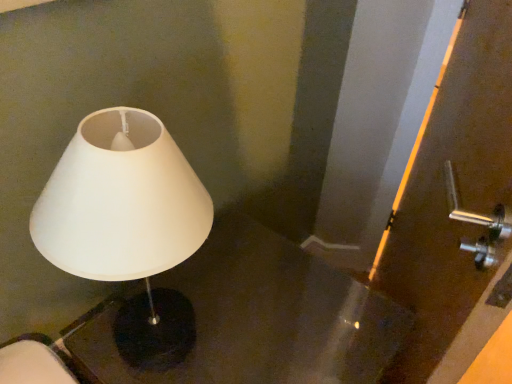
The width and height of the screenshot is (512, 384). What are the coordinates of `black glossy table at left` in the screenshot? It's located at (259, 318).

Locate an element on the screen. The height and width of the screenshot is (384, 512). white matte lampshade at left is located at coordinates [127, 226].

Locate an element on the screen. The height and width of the screenshot is (384, 512). black glossy table at left is located at coordinates (259, 318).

Is white matte lampshade at left oriented away from black glossy table at left?

Result: No, white matte lampshade at left is not facing the opposite direction of black glossy table at left.

How distant is white matte lampshade at left from black glossy table at left?

white matte lampshade at left is 13.62 inches away from black glossy table at left.

Can you confirm if white matte lampshade at left is thinner than black glossy table at left?

Yes.

Does white matte lampshade at left lie in front of black glossy table at left?

Yes.

Does black glossy table at left come in front of matte brown screen door at right?

No.

Considering the relative sizes of black glossy table at left and matte brown screen door at right in the image provided, is black glossy table at left shorter than matte brown screen door at right?

Correct, black glossy table at left is not as tall as matte brown screen door at right.

From the image's perspective, which one is positioned lower, black glossy table at left or matte brown screen door at right?

black glossy table at left is shown below in the image.

Is point (462, 141) positioned in front of point (188, 335)?

That is True.

From the image's perspective, which is above, matte brown screen door at right or white matte lampshade at left?

From the image's view, matte brown screen door at right is above.

How different are the orientations of matte brown screen door at right and white matte lampshade at left in degrees?

The angle between the facing direction of matte brown screen door at right and the facing direction of white matte lampshade at left is 26.4 degrees.

Is white matte lampshade at left oriented away from matte brown screen door at right?

No, matte brown screen door at right is not at the back of white matte lampshade at left.

Is white matte lampshade at left shorter than matte brown screen door at right?

Correct, white matte lampshade at left is not as tall as matte brown screen door at right.

Is white matte lampshade at left far from matte brown screen door at right?

That's not correct — white matte lampshade at left is a little close to matte brown screen door at right.

Is matte brown screen door at right inside the boundaries of black glossy table at left, or outside?

matte brown screen door at right is not enclosed by black glossy table at left.

Considering the positions of objects matte brown screen door at right and black glossy table at left in the image provided, who is in front, matte brown screen door at right or black glossy table at left?

Positioned in front is matte brown screen door at right.

From a real-world perspective, is matte brown screen door at right on black glossy table at left?

Yes, from a real-world perspective, matte brown screen door at right is over black glossy table at left

Does black glossy table at left appear on the right side of white matte lampshade at left?

Correct, you'll find black glossy table at left to the right of white matte lampshade at left.

Could you tell me if black glossy table at left is facing white matte lampshade at left?

No, black glossy table at left is not aimed at white matte lampshade at left.

Is black glossy table at left surrounding white matte lampshade at left?

That's incorrect, white matte lampshade at left is not inside black glossy table at left.

Considering the points (283, 265) and (153, 176), which point is behind, point (283, 265) or point (153, 176)?

Positioned behind is point (283, 265).

This screenshot has width=512, height=384. I want to click on table located below the white matte lampshade at left (from the image's perspective), so click(259, 318).

What are the coordinates of `screen door on the right of black glossy table at left` in the screenshot? It's located at (448, 207).

Looking at the image, which one is located closer to white matte lampshade at left, black glossy table at left or matte brown screen door at right?

The object closer to white matte lampshade at left is black glossy table at left.

Based on their spatial positions, is white matte lampshade at left or black glossy table at left further from matte brown screen door at right?

white matte lampshade at left lies further to matte brown screen door at right than the other object.

When comparing their distances from white matte lampshade at left, does matte brown screen door at right or black glossy table at left seem further?

The object further to white matte lampshade at left is matte brown screen door at right.

Looking at the image, which one is located further to black glossy table at left, white matte lampshade at left or matte brown screen door at right?

white matte lampshade at left.

Based on their spatial positions, is black glossy table at left or white matte lampshade at left closer to matte brown screen door at right?

black glossy table at left lies closer to matte brown screen door at right than the other object.

When comparing their distances from black glossy table at left, does matte brown screen door at right or white matte lampshade at left seem further?

Among the two, white matte lampshade at left is located further to black glossy table at left.

You are a GUI agent. You are given a task and a screenshot of the screen. Output one action in this format:
    pyautogui.click(x=<x>, y=<y>)
    Task: Click on the table between white matte lampshade at left and matte brown screen door at right
    The width and height of the screenshot is (512, 384).
    Given the screenshot: What is the action you would take?
    pyautogui.click(x=259, y=318)